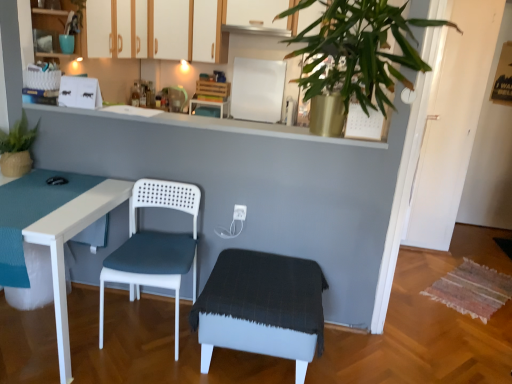
The image size is (512, 384). What are the coordinates of `vacant space underneath white matte table at left (from a real-world perspective)` in the screenshot? It's located at (44, 336).